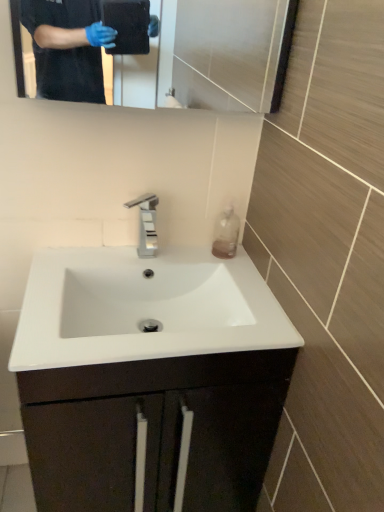
This screenshot has width=384, height=512. In order to click on vacant space in front of translucent plastic bottle at right in this screenshot , I will do `click(230, 275)`.